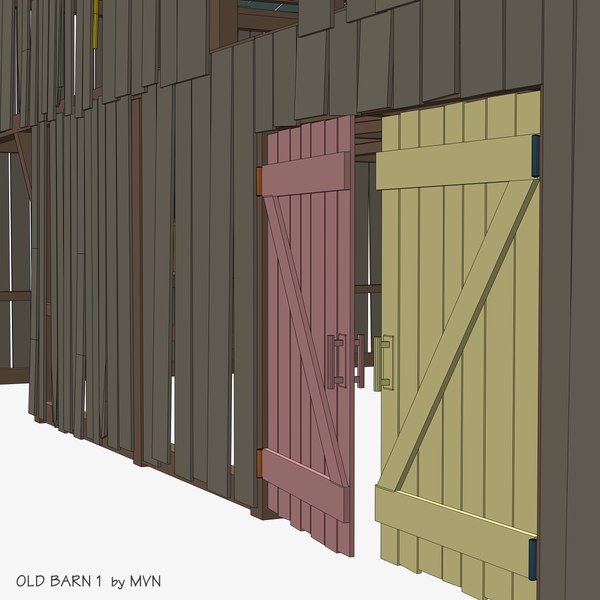
The width and height of the screenshot is (600, 600). I want to click on pink door, so click(298, 371).